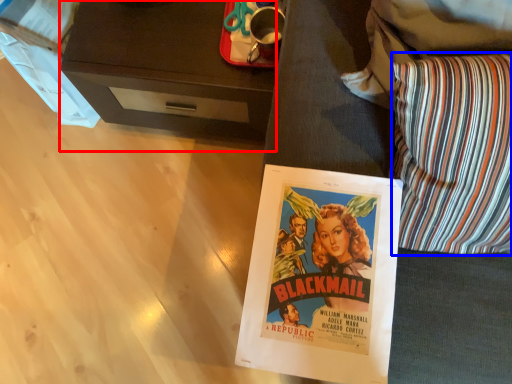
Question: Which of the following is the farthest to the observer, desk (highlighted by a red box) or throw pillow (highlighted by a blue box)?

Choices:
 (A) desk
 (B) throw pillow

Answer: (A)